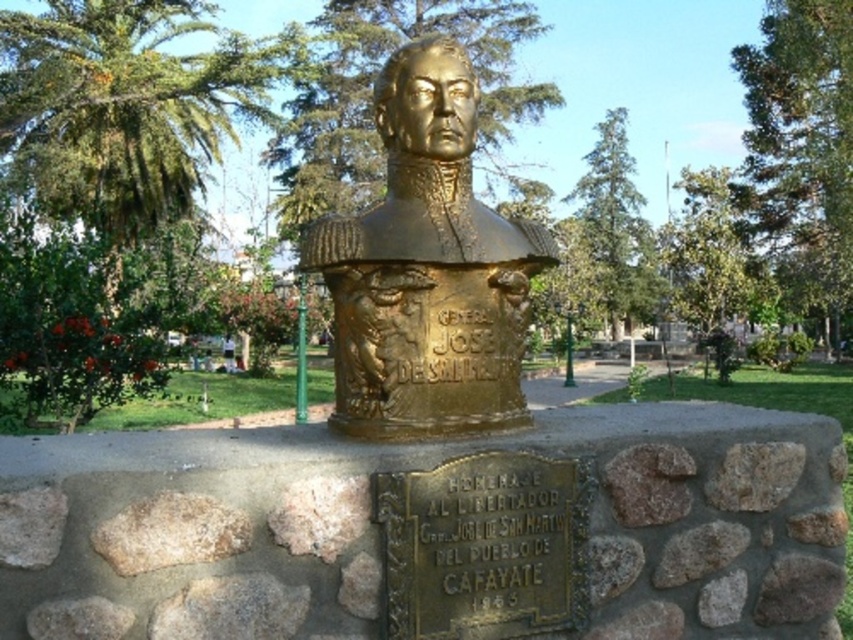
Which of these two, green leafy palm tree at upper center or rough textured stone at lower left, stands taller?

green leafy palm tree at upper center

Consider the image. Which of these two, green leafy palm tree at upper center or rough textured stone at lower left, stands shorter?

rough textured stone at lower left

Image resolution: width=853 pixels, height=640 pixels. What do you see at coordinates (125, 106) in the screenshot?
I see `green leafy palm tree at upper center` at bounding box center [125, 106].

Locate an element on the screen. green leafy palm tree at upper center is located at coordinates (125, 106).

Which is more to the right, gold polished bust at center or rough textured stone at lower left?

From the viewer's perspective, gold polished bust at center appears more on the right side.

Which is above, gold polished bust at center or rough textured stone at lower left?

gold polished bust at center is higher up.

Is point (386, 301) positioned before point (221, 518)?

That is False.

This screenshot has width=853, height=640. Find the location of `gold polished bust at center`. gold polished bust at center is located at coordinates (427, 269).

Can you confirm if gold polished bust at center is smaller than green leafy palm tree at upper center?

Indeed, gold polished bust at center has a smaller size compared to green leafy palm tree at upper center.

Does point (480, 220) come in front of point (132, 92)?

Yes, point (480, 220) is closer to viewer.

Find the location of a particular element. The height and width of the screenshot is (640, 853). gold polished bust at center is located at coordinates (427, 269).